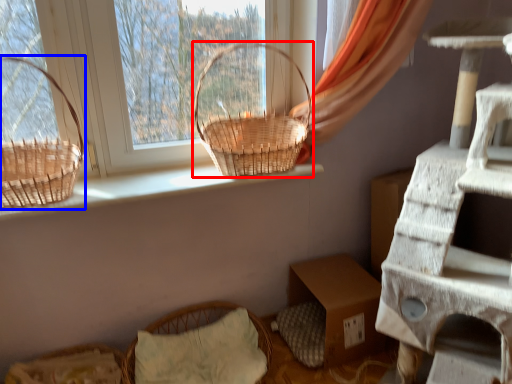
Question: Which object appears farthest to the camera in this image, picnic basket (highlighted by a red box) or picnic basket (highlighted by a blue box)?

Choices:
 (A) picnic basket
 (B) picnic basket

Answer: (A)